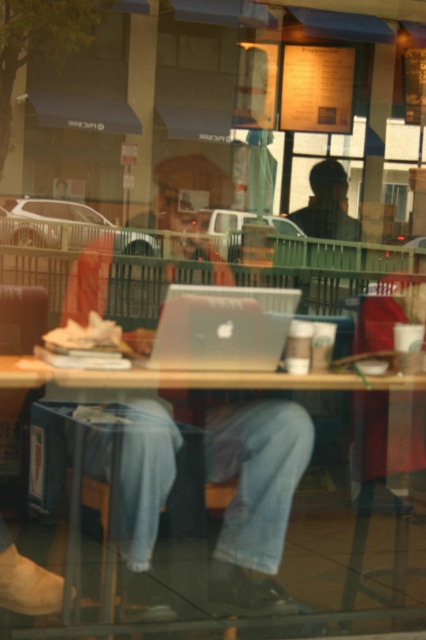
You are a delivery person who needs to place a package on the wooden table at center without touching the satin silver laptop at center. Is there enough space between them to do this?

The distance between the wooden table at center and the satin silver laptop at center is 36.15 inches, so yes, there is enough space to place the package without touching the laptop.